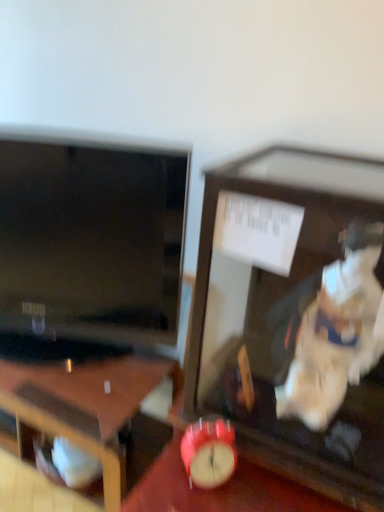
Based on the photo, measure the distance between wooden desk at lower left and camera.

The distance of wooden desk at lower left from camera is 36.30 inches.

What do you see at coordinates (294, 315) in the screenshot? I see `wooden display case at center` at bounding box center [294, 315].

Find the location of a particular element. The image size is (384, 512). matte black tv at left is located at coordinates (92, 239).

Locate an element on the screen. matte red alarm clock at center is located at coordinates (221, 490).

Would you say wooden desk at lower left is outside matte red alarm clock at center?

Yes, wooden desk at lower left is outside of matte red alarm clock at center.

Which of these two, wooden desk at lower left or matte red alarm clock at center, is bigger?

wooden desk at lower left.

From the image's perspective, is wooden desk at lower left located beneath matte red alarm clock at center?

Actually, wooden desk at lower left appears above matte red alarm clock at center in the image.

Measure the distance between wooden desk at lower left and matte red alarm clock at center.

9.45 inches.

Between matte red alarm clock at lower right and wooden desk at lower left, which one has smaller size?

Smaller between the two is matte red alarm clock at lower right.

Where is `alarm clock above the wooden desk at lower left (from the image's perspective)`? Image resolution: width=384 pixels, height=512 pixels. alarm clock above the wooden desk at lower left (from the image's perspective) is located at coordinates (209, 453).

Which of these two, matte red alarm clock at lower right or wooden desk at lower left, is wider?

wooden desk at lower left.

Is matte red alarm clock at lower right taller than wooden desk at lower left?

No, matte red alarm clock at lower right is not taller than wooden desk at lower left.

Is wooden display case at center inside or outside of matte red alarm clock at center?

wooden display case at center is spatially situated outside matte red alarm clock at center.

From the image's perspective, which one is positioned higher, wooden display case at center or matte red alarm clock at center?

wooden display case at center, from the image's perspective.

Is wooden display case at center to the left or to the right of matte red alarm clock at center in the image?

Clearly, wooden display case at center is on the right of matte red alarm clock at center in the image.

Which object is thinner, wooden display case at center or matte red alarm clock at center?

matte red alarm clock at center.

How distant is matte red alarm clock at center from wooden display case at center?

matte red alarm clock at center and wooden display case at center are 10.97 inches apart.

Based on the photo, are matte red alarm clock at center and wooden display case at center beside each other?

matte red alarm clock at center is not next to wooden display case at center, and they're not touching.

Which is in front, matte red alarm clock at center or wooden display case at center?

Positioned in front is wooden display case at center.

Based on the photo, between matte red alarm clock at center and wooden display case at center, which one has less height?

Standing shorter between the two is matte red alarm clock at center.

Is wooden display case at center taller than matte black tv at left?

No, wooden display case at center is not taller than matte black tv at left.

Can you confirm if wooden display case at center is bigger than matte black tv at left?

Indeed, wooden display case at center has a larger size compared to matte black tv at left.

Considering the points (270, 416) and (101, 257), which point is behind, point (270, 416) or point (101, 257)?

The point (101, 257) is behind.

Is wooden display case at center located within matte red alarm clock at lower right?

No, matte red alarm clock at lower right does not contain wooden display case at center.

How many degrees apart are the facing directions of matte red alarm clock at lower right and wooden display case at center?

They differ by 41.3 degrees in their facing directions.

Considering the sizes of objects matte red alarm clock at lower right and wooden display case at center in the image provided, who is wider, matte red alarm clock at lower right or wooden display case at center?

wooden display case at center.

In order to click on alarm clock that is on the left side of wooden display case at center in this screenshot , I will do `click(209, 453)`.

From a real-world perspective, does matte red alarm clock at lower right sit lower than matte red alarm clock at center?

No.

At what (x,y) coordinates should I click in order to perform the action: click on table beneath the matte red alarm clock at lower right (from a real-world perspective). Please return your answer as a coordinate pair (x, y). Looking at the image, I should click on (221, 490).

Is matte red alarm clock at lower right looking in the opposite direction of matte red alarm clock at center?

No.

Which object is thinner, matte red alarm clock at lower right or matte red alarm clock at center?

Thinner between the two is matte red alarm clock at lower right.

Where is `desk on the left side of matte red alarm clock at center`? This screenshot has width=384, height=512. desk on the left side of matte red alarm clock at center is located at coordinates (84, 406).

Where is `alarm clock located above the wooden desk at lower left (from a real-world perspective)`? The width and height of the screenshot is (384, 512). alarm clock located above the wooden desk at lower left (from a real-world perspective) is located at coordinates (209, 453).

When comparing their distances from wooden desk at lower left, does matte black tv at left or wooden display case at center seem closer?

The object closer to wooden desk at lower left is matte black tv at left.

From the image, which object appears to be nearer to matte black tv at left, wooden desk at lower left or matte red alarm clock at lower right?

wooden desk at lower left.

From the image, which object appears to be farther from matte red alarm clock at lower right, matte black tv at left or wooden desk at lower left?

matte black tv at left.

When comparing their distances from matte black tv at left, does wooden display case at center or matte red alarm clock at center seem further?

The object further to matte black tv at left is matte red alarm clock at center.

From the image, which object appears to be farther from wooden desk at lower left, matte red alarm clock at center or matte black tv at left?

matte black tv at left is further to wooden desk at lower left.

Looking at the image, which one is located closer to matte red alarm clock at lower right, matte black tv at left or matte red alarm clock at center?

matte red alarm clock at center is positioned closer to the anchor matte red alarm clock at lower right.

Based on their spatial positions, is matte black tv at left or matte red alarm clock at lower right further from matte red alarm clock at center?

matte black tv at left lies further to matte red alarm clock at center than the other object.

Based on their spatial positions, is matte black tv at left or matte red alarm clock at lower right closer to wooden display case at center?

matte red alarm clock at lower right.

Identify the location of table between wooden desk at lower left and wooden display case at center from left to right. (221, 490).

This screenshot has height=512, width=384. Find the location of `furniture between matte black tv at left and matte red alarm clock at center in the vertical direction`. furniture between matte black tv at left and matte red alarm clock at center in the vertical direction is located at coordinates click(294, 315).

Identify the location of alarm clock between wooden desk at lower left and matte red alarm clock at center in the horizontal direction. This screenshot has width=384, height=512. (209, 453).

The height and width of the screenshot is (512, 384). I want to click on alarm clock between matte black tv at left and matte red alarm clock at center in the vertical direction, so click(x=209, y=453).